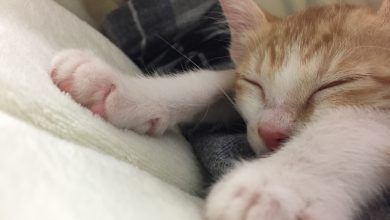
The image size is (390, 220). Identify the location of soft white blanket. (65, 112).